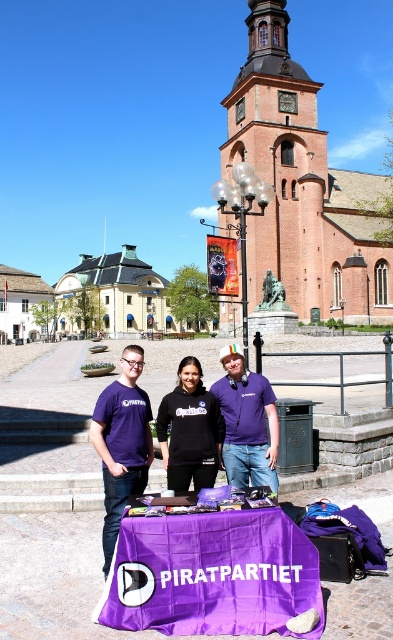
You are a photographer trying to capture a clear photo of both the black matte hoodie at center and the black matte sweatshirt at center. Since you can only focus on one object at a time, which one should you focus on to ensure the other remains in the background?

You should focus on the black matte hoodie at center because it is closer to the viewer, which will keep the black matte sweatshirt at center in the background.

You are at a public square and see two items on the table covered with a purple cloth. One is a black matte hoodie at center and the other is a black matte sweatshirt at center. Which one is positioned to the left?

The black matte hoodie at center is positioned to the left of the black matte sweatshirt at center.